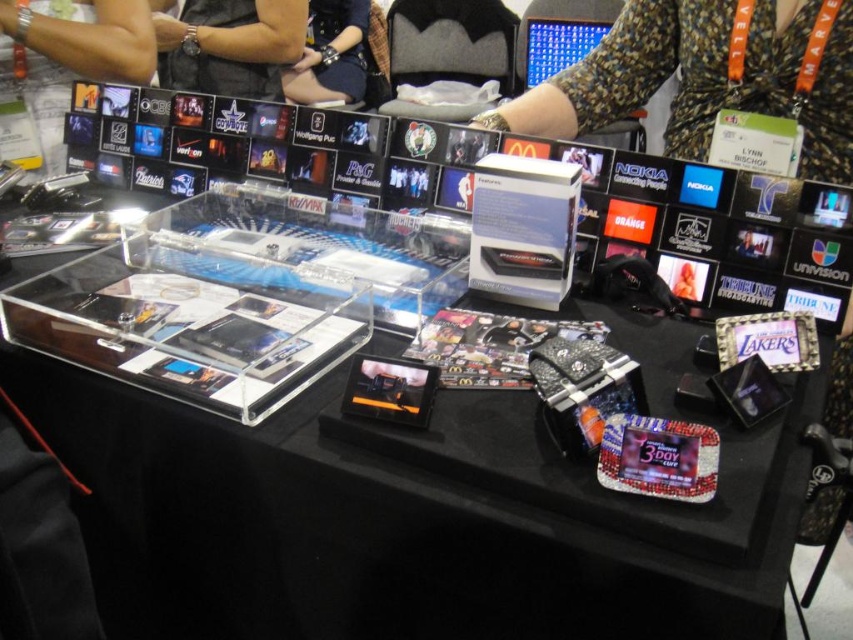
From the picture: You are standing at the exhibition table and want to pick up an item. There are two points marked on the table where items are placed. Which point is closer to you, point (734,104) or point (358,74)?

Point (734,104) is closer to the camera than point (358,74), so the item at point (734,104) is closer to you.

You are setting up a booth at a trade show and need to place a new promotional item on the table. The item requires a spot that is not currently occupied by the transparent acrylic tray at center. Where should you place it?

Since the transparent acrylic tray at center is located at point (387, 493), you should place the new promotional item in an area of the table that does not overlap with this coordinate to avoid occupying the same space.